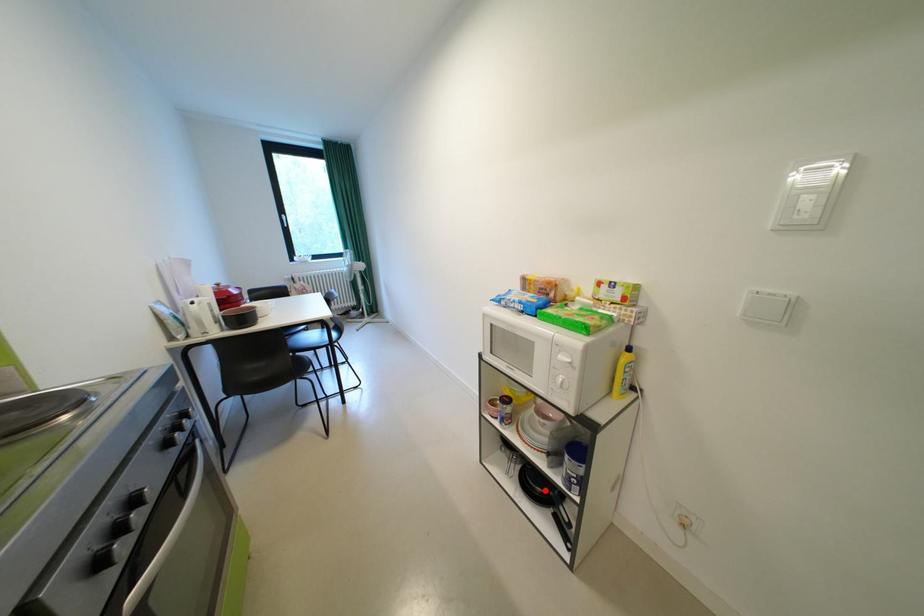
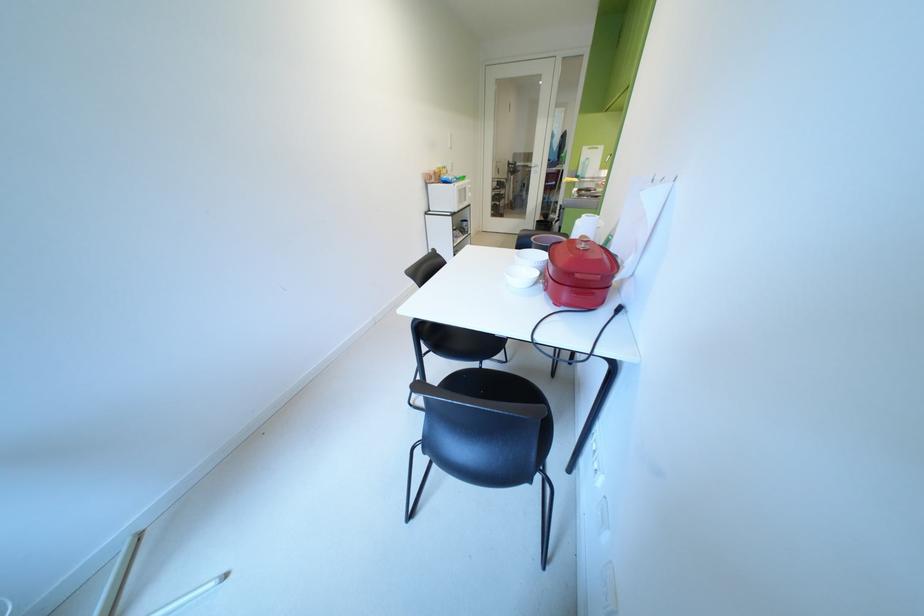
Question: I am providing you with two images of the same scene from different viewpoints. A red point is marked on the first image. Can you still see the location of the red point in image 2?

Choices:
 (A) Yes
 (B) No

Answer: (B)